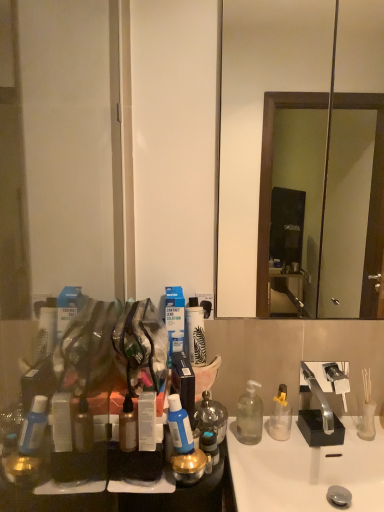
Question: Is transparent plastic container at center taller or shorter than clear plastic bottle at center, which ranks as the fourth bottle in front-to-back order?

Choices:
 (A) short
 (B) tall

Answer: (A)

Question: Considering the positions of transparent plastic container at center and clear plastic bottle at center, the 1th bottle when ordered from right to left, in the image, is transparent plastic container at center bigger or smaller than clear plastic bottle at center, the 1th bottle when ordered from right to left,?

Choices:
 (A) small
 (B) big

Answer: (A)

Question: Based on their relative distances, which object is farther from the transparent plastic container at center?

Choices:
 (A) metallic silver spray can at lower left, the fourth bottle positioned from the back
 (B) clear plastic bottle at center, the 1th bottle when ordered from right to left
 (C) white glossy sink at lower center
 (D) transparent glass bottle at lower right, which is the third bottle in front-to-back order
 (E) wooden framed mirror at center

Answer: (E)

Question: Considering the real-world distances, which object is farthest from the metallic silver spray can at lower left, the 4th bottle in the right-to-left sequence?

Choices:
 (A) transparent plastic container at center
 (B) transparent glass bottle at lower right, which is the 2th bottle in back-to-front order
 (C) blue translucent bottle at center, the 3th bottle in the back-to-front sequence
 (D) white glossy sink at lower center
 (E) wooden framed mirror at center

Answer: (E)